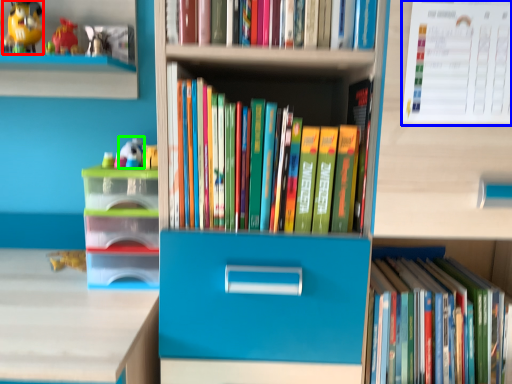
Question: Estimate the real-world distances between objects in this image. Which object is farther from toy (highlighted by a red box), paperback book (highlighted by a blue box) or toy (highlighted by a green box)?

Choices:
 (A) paperback book
 (B) toy

Answer: (A)